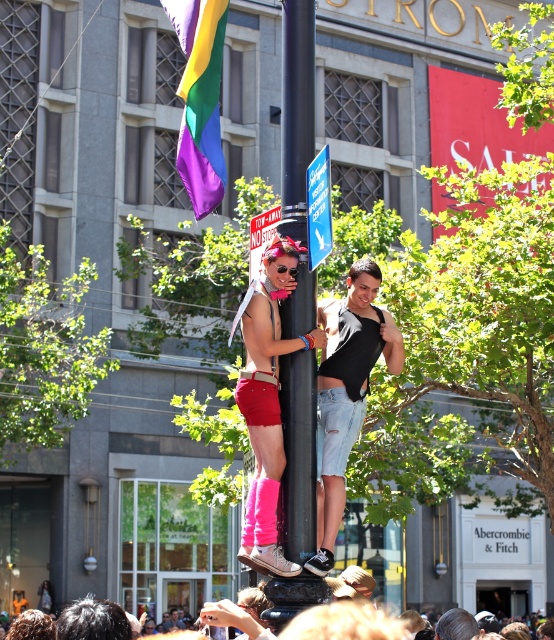
Question: Among these points, which one is farthest from the camera?

Choices:
 (A) (325, 218)
 (B) (189, 52)

Answer: (B)

Question: Is the position of black matte bikini top at upper center less distant than that of black hair at lower left?

Choices:
 (A) no
 (B) yes

Answer: (A)

Question: Considering the real-world distances, which object is farthest from the purple fabric flag at upper left?

Choices:
 (A) black matte bikini top at upper center
 (B) pink satin shorts at center

Answer: (A)

Question: From the image, what is the correct spatial relationship of black matte bikini top at upper center in relation to brown hair at lower center?

Choices:
 (A) left
 (B) right

Answer: (B)

Question: Is pink matte shorts at center smaller than purple fabric flag at upper left?

Choices:
 (A) yes
 (B) no

Answer: (B)

Question: Which is nearer to the black metal pole at center?

Choices:
 (A) metallic pole at center
 (B) purple fabric flag at upper left
 (C) brown hair at lower center
 (D) black hair at lower left

Answer: (B)